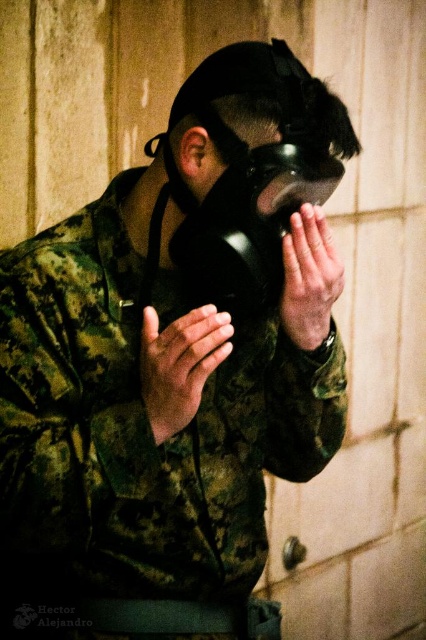
Does point (157, 381) come farther from viewer compared to point (325, 275)?

No, it is in front of (325, 275).

Between point (192, 316) and point (299, 224), which one is positioned in front?

Point (192, 316) is in front.

This screenshot has height=640, width=426. Describe the element at coordinates (180, 364) in the screenshot. I see `matte camouflage hand at center` at that location.

Where is `matte camouflage hand at center`? matte camouflage hand at center is located at coordinates (180, 364).